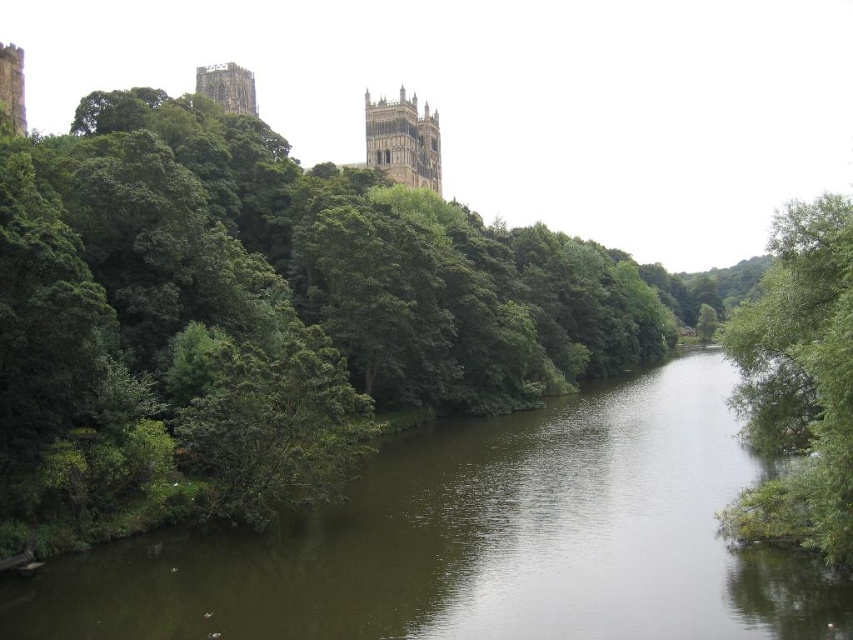
Between green leafy tree at upper left and green leafy tree at right, which one appears on the left side from the viewer's perspective?

green leafy tree at upper left

Which of these two, green leafy tree at upper left or green leafy tree at right, stands shorter?

With less height is green leafy tree at right.

What are the coordinates of `green leafy tree at upper left` in the screenshot? It's located at (257, 320).

Where is `green leafy tree at upper left`? The image size is (853, 640). green leafy tree at upper left is located at coordinates (257, 320).

Who is more forward, (283,188) or (206,86)?

Point (283,188)

You are a GUI agent. You are given a task and a screenshot of the screen. Output one action in this format:
    pyautogui.click(x=<x>, y=<y>)
    Task: Click on the green leafy tree at upper left
    This screenshot has height=640, width=853.
    Given the screenshot: What is the action you would take?
    pos(257,320)

Measure the distance from green leafy tree at right to stone tower at upper left.

The distance of green leafy tree at right from stone tower at upper left is 358.95 feet.

Between point (753, 426) and point (242, 77), which one is positioned in front?

Point (753, 426)

Identify the location of green leafy tree at right. (799, 381).